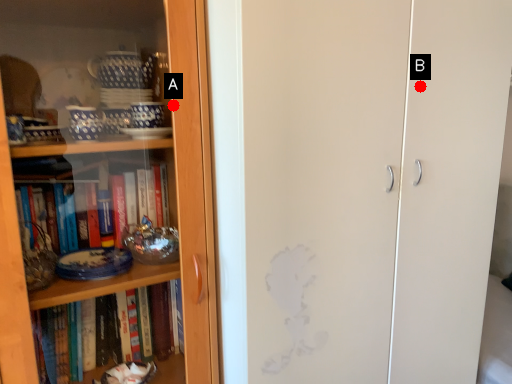
Question: Two points are circled on the image, labeled by A and B beside each circle. Which point is closer to the camera taking this photo?

Choices:
 (A) A is closer
 (B) B is closer

Answer: (A)